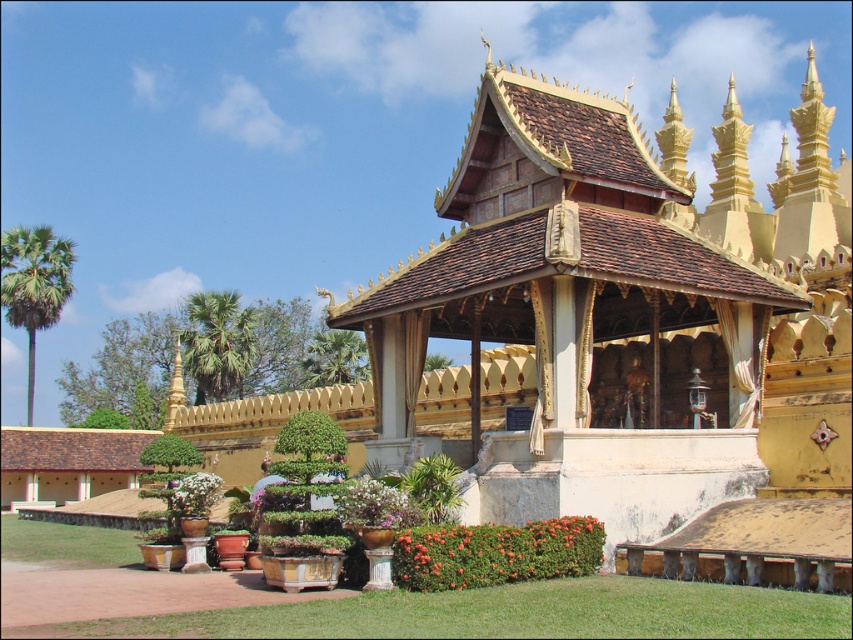
Can you confirm if green leafy plant at center is smaller than white matte flower pot at lower center?

Yes, green leafy plant at center is smaller than white matte flower pot at lower center.

Can you confirm if green leafy plant at center is thinner than white matte flower pot at lower center?

Indeed, green leafy plant at center has a lesser width compared to white matte flower pot at lower center.

Locate an element on the screen. green leafy plant at center is located at coordinates (433, 486).

What are the coordinates of `green leafy plant at center` in the screenshot? It's located at 433,486.

Which is more to the left, green leafy bush at lower center or green leafy plant at lower left?

Positioned to the left is green leafy plant at lower left.

Is point (567, 540) more distant than point (20, 554)?

No, it is in front of (20, 554).

Image resolution: width=853 pixels, height=640 pixels. Find the location of `green leafy bush at lower center`. green leafy bush at lower center is located at coordinates (495, 552).

Who is shorter, golden wood gazebo at center or white matte flowers at center?

With less height is white matte flowers at center.

Can you confirm if golden wood gazebo at center is positioned to the left of white matte flowers at center?

Incorrect, golden wood gazebo at center is not on the left side of white matte flowers at center.

In order to click on golden wood gazebo at center in this screenshot , I will do `click(572, 314)`.